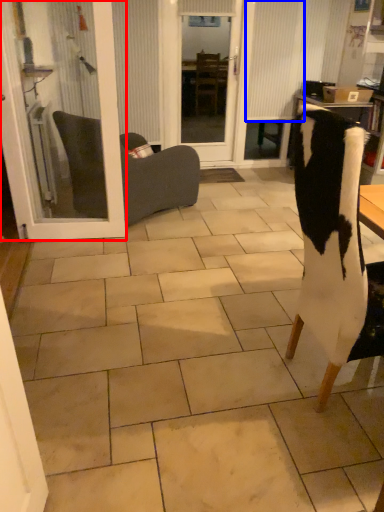
Question: Which of the following is the farthest to the observer, door (highlighted by a red box) or curtain (highlighted by a blue box)?

Choices:
 (A) door
 (B) curtain

Answer: (B)